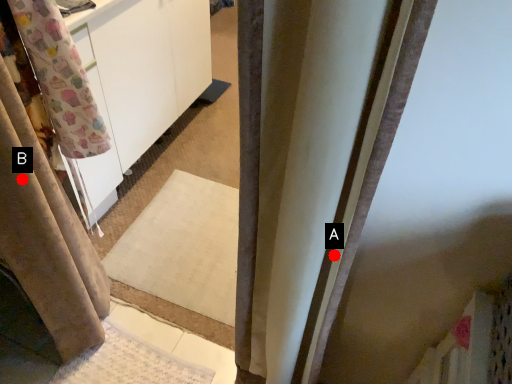
Question: Two points are circled on the image, labeled by A and B beside each circle. Which point is closer to the camera?

Choices:
 (A) A is closer
 (B) B is closer

Answer: (A)